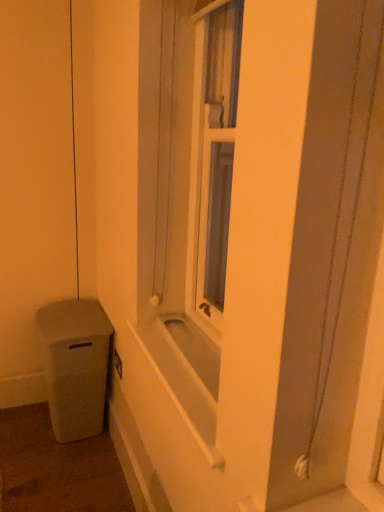
Question: Is point (177, 327) closer or farther from the camera than point (87, 395)?

Choices:
 (A) closer
 (B) farther

Answer: (A)

Question: Is white matte bathtub at center taller or shorter than matte gray trash can at lower left?

Choices:
 (A) short
 (B) tall

Answer: (A)

Question: In the image, is white matte bathtub at center positioned in front of or behind matte gray trash can at lower left?

Choices:
 (A) front
 (B) behind

Answer: (A)

Question: Is matte gray trash can at lower left inside the boundaries of white matte bathtub at center, or outside?

Choices:
 (A) inside
 (B) outside

Answer: (B)

Question: Visually, is matte gray trash can at lower left positioned to the left or to the right of white matte bathtub at center?

Choices:
 (A) right
 (B) left

Answer: (B)

Question: Does point (49, 403) appear closer or farther from the camera than point (145, 336)?

Choices:
 (A) farther
 (B) closer

Answer: (A)

Question: From their relative heights in the image, would you say matte gray trash can at lower left is taller or shorter than white matte bathtub at center?

Choices:
 (A) short
 (B) tall

Answer: (B)